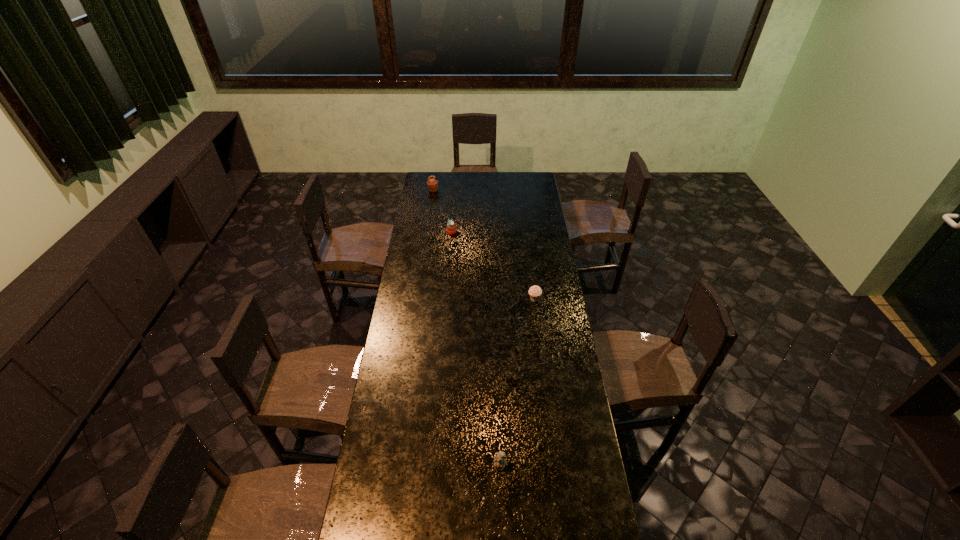
Identify the location of vacant area that lies between the third object from right to left and the second object from right to left. The width and height of the screenshot is (960, 540). (476, 349).

I want to click on vacant area between the second farthest muffin and the rightmost object, so (x=493, y=266).

The width and height of the screenshot is (960, 540). Find the location of `free spot between the second object from right to left and the rightmost object`. free spot between the second object from right to left and the rightmost object is located at coordinates (517, 383).

The image size is (960, 540). I want to click on free space between the leftmost muffin and the third nearest object, so click(x=443, y=211).

You are a GUI agent. You are given a task and a screenshot of the screen. Output one action in this format:
    pyautogui.click(x=<x>, y=<y>)
    Task: Click on the free area in between the teddy bear and the nearest muffin
    
    Given the screenshot: What is the action you would take?
    pyautogui.click(x=517, y=383)

Identify the location of empty location between the leftmost muffin and the second muffin from right to left. This screenshot has width=960, height=540. (443, 211).

Locate an element on the screen. This screenshot has height=540, width=960. free space between the leftmost muffin and the teddy bear is located at coordinates (467, 328).

Identify the location of empty space between the third farthest object and the leftmost muffin. This screenshot has height=540, width=960. (484, 245).

Choose which object is the second nearest neighbor to the teddy bear. Please provide its 2D coordinates. Your answer should be formatted as a tuple, i.e. [(x, y)], where the tuple contains the x and y coordinates of a point satisfying the conditions above.

[(451, 229)]

Identify which object is the third closest to the rightmost muffin. Please provide its 2D coordinates. Your answer should be formatted as a tuple, i.e. [(x, y)], where the tuple contains the x and y coordinates of a point satisfying the conditions above.

[(432, 184)]